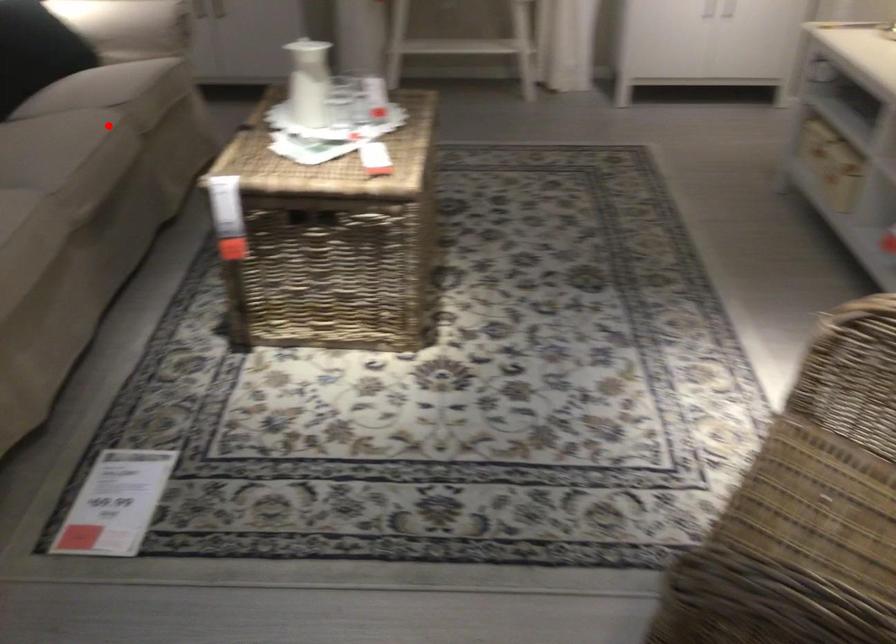
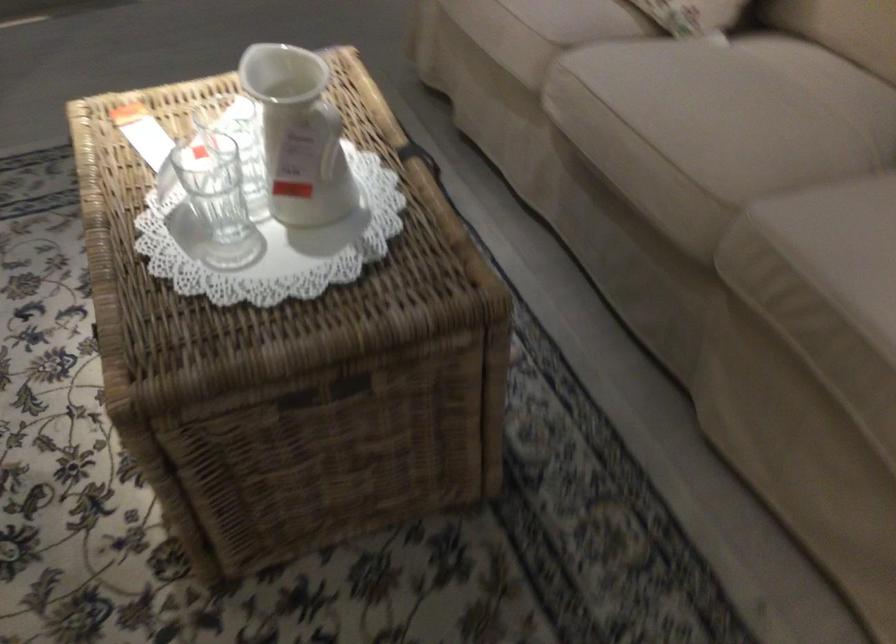
Question: I am providing you with two images of the same scene from different viewpoints. Image1 has a red point marked. In image2, the corresponding 3D location appears at what relative position? Reply with the corresponding letter.

Choices:
 (A) Closer
 (B) Farther

Answer: (A)